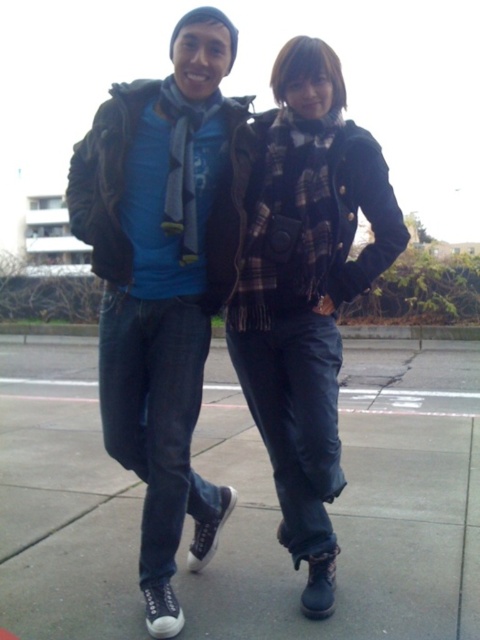
Can you confirm if matte black jacket at center is positioned above black rubber shoes at lower center?

Indeed, matte black jacket at center is positioned over black rubber shoes at lower center.

Which is behind, point (253, 161) or point (448, 428)?

The point (448, 428) is more distant.

I want to click on matte black jacket at center, so click(243, 250).